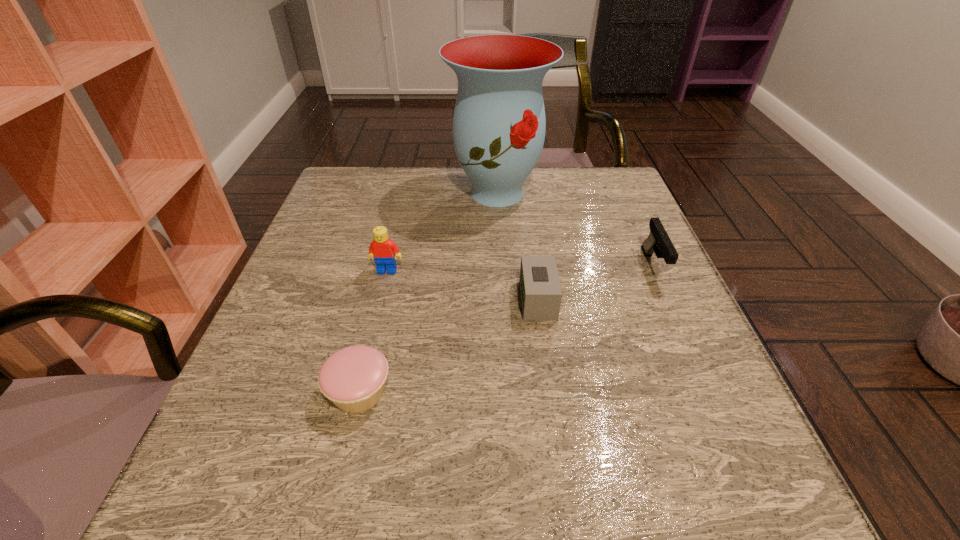
Where is `the farthest object`? The width and height of the screenshot is (960, 540). the farthest object is located at coordinates (499, 124).

In order to click on the tallest object in this screenshot , I will do `click(499, 124)`.

Identify the location of Lego. (384, 251).

Where is `the third tallest object`? the third tallest object is located at coordinates (658, 242).

The image size is (960, 540). What are the coordinates of `the rightmost object` in the screenshot? It's located at (658, 242).

Identify the location of alarm clock. (541, 294).

Image resolution: width=960 pixels, height=540 pixels. Find the location of `the nearest object`. the nearest object is located at coordinates pos(353,378).

Locate an element on the screen. The image size is (960, 540). vacant region located on the left of the farthest object is located at coordinates (344, 193).

This screenshot has height=540, width=960. I want to click on free space located 0.320m on the face of the Lego, so click(x=353, y=414).

You are a GUI agent. You are given a task and a screenshot of the screen. Output one action in this format:
    pyautogui.click(x=<x>, y=<y>)
    Task: Click on the free region located 0.310m on the front-facing side of the third tallest object
    The image size is (960, 540).
    Given the screenshot: What is the action you would take?
    pyautogui.click(x=728, y=435)